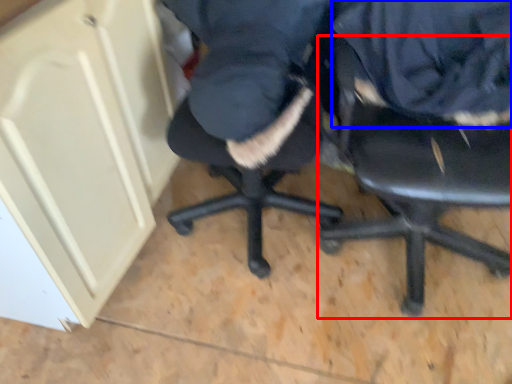
Question: Which of the following is the farthest to the observer, chair (highlighted by a red box) or clothing (highlighted by a blue box)?

Choices:
 (A) chair
 (B) clothing

Answer: (B)